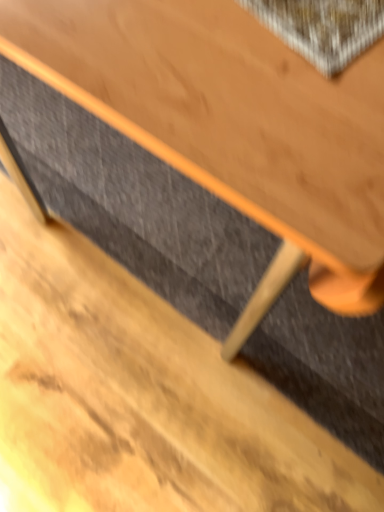
What do you see at coordinates (232, 119) in the screenshot? The image size is (384, 512). I see `wooden table at center` at bounding box center [232, 119].

Where is `wooden table at center`? The width and height of the screenshot is (384, 512). wooden table at center is located at coordinates (232, 119).

You are a GUI agent. You are given a task and a screenshot of the screen. Output one action in this format:
    pyautogui.click(x=<x>, y=<y>)
    Task: Click on the wooden table at center
    The height and width of the screenshot is (512, 384).
    Given the screenshot: What is the action you would take?
    pyautogui.click(x=232, y=119)